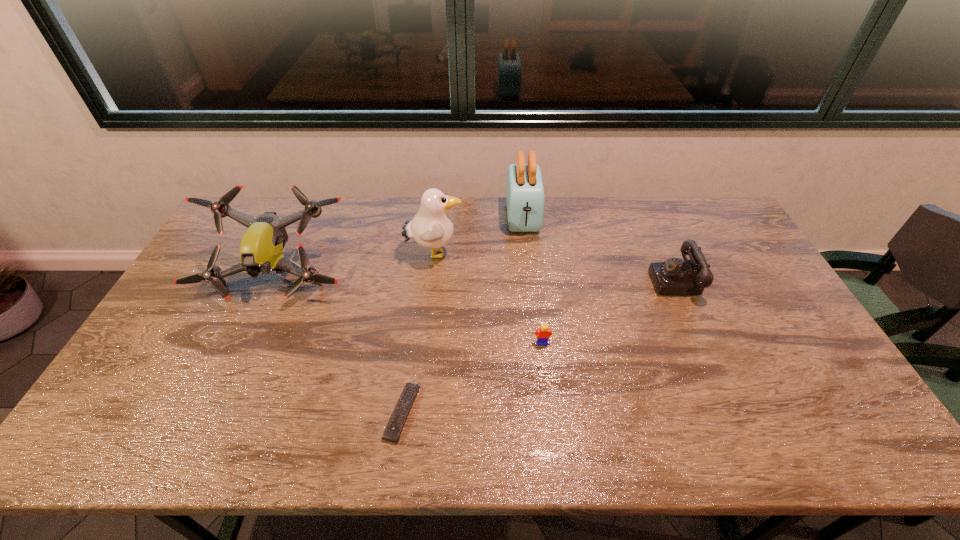
Find the location of a particular element. vacant position at the far edge of the desktop is located at coordinates (416, 214).

The width and height of the screenshot is (960, 540). Find the location of `free space at the near edge of the desktop`. free space at the near edge of the desktop is located at coordinates (571, 434).

Where is `vacant space at the left edge of the desktop`? This screenshot has height=540, width=960. vacant space at the left edge of the desktop is located at coordinates (159, 407).

In the image, there is a desktop. Where is `vacant area at the right edge`? Image resolution: width=960 pixels, height=540 pixels. vacant area at the right edge is located at coordinates (737, 270).

Where is `vacant space at the far left corner`? The width and height of the screenshot is (960, 540). vacant space at the far left corner is located at coordinates (245, 211).

Find the location of `vacant space at the near left corner of the desktop`. vacant space at the near left corner of the desktop is located at coordinates (115, 428).

Locate an element on the screen. The image size is (960, 540). vacant area that lies between the fifth farthest object and the gull is located at coordinates (488, 298).

Locate an element on the screen. This screenshot has height=540, width=960. vacant area between the toaster and the telephone is located at coordinates (599, 248).

Where is `vacant space in between the telephone and the gull`? vacant space in between the telephone and the gull is located at coordinates (555, 267).

You are a GUI agent. You are given a task and a screenshot of the screen. Output one action in this format:
    pyautogui.click(x=<x>, y=<y>)
    Task: Click on the unoccupied position between the Lego and the leftmost object
    
    Given the screenshot: What is the action you would take?
    pyautogui.click(x=410, y=310)